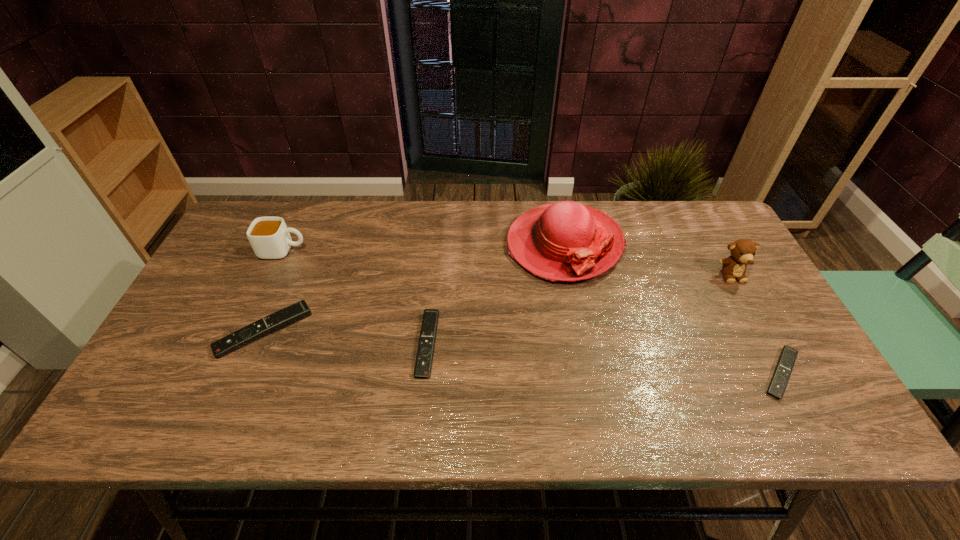
What are the coordinates of `vacant position for inserting another remote_control evenly` in the screenshot? It's located at (599, 359).